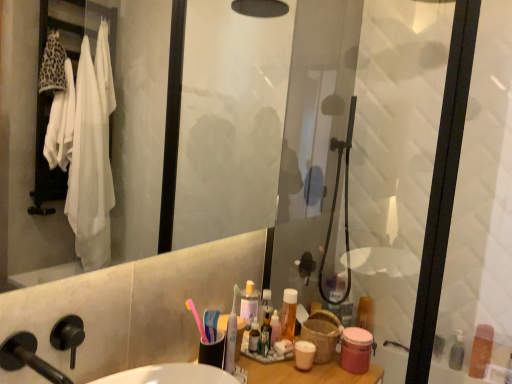
What is the approximate width of matte plastic container at right, which is the 1th toiletry from back to front?

matte plastic container at right, which is the 1th toiletry from back to front, is 4.00 inches wide.

What do you see at coordinates (28, 358) in the screenshot? I see `black matte faucet at lower left` at bounding box center [28, 358].

In order to face transparent glass shower door at right, should I rotate leftwards or rightwards?

You should look right and rotate roughly 17.187 degrees.

This screenshot has height=384, width=512. I want to click on matte plastic container at right, which is counted as the third toiletry, starting from the left, so click(365, 313).

What's the angular difference between black matte faucet at lower left and transparent glass shower door at right's facing directions?

88.7 degrees separate the facing orientations of black matte faucet at lower left and transparent glass shower door at right.

From the picture: From a real-world perspective, is black matte faucet at lower left under transparent glass shower door at right?

Indeed, from a real-world perspective, black matte faucet at lower left is positioned beneath transparent glass shower door at right.

Does black matte faucet at lower left have a greater width compared to transparent glass shower door at right?

Yes.

Would you say black matte faucet at lower left is a long distance from transparent glass shower door at right?

black matte faucet at lower left is far away from transparent glass shower door at right.

Is pink matte jar at lower right, placed as the first toiletry when sorted from front to back, turned away from matte plastic container at right, which is counted as the third toiletry, starting from the left?

No, pink matte jar at lower right, placed as the first toiletry when sorted from front to back, is not facing away from matte plastic container at right, which is counted as the third toiletry, starting from the left.

Is point (368, 363) closer to camera compared to point (368, 308)?

Yes, point (368, 363) is closer to viewer.

Considering the positions of objects pink matte jar at lower right, placed as the 3th toiletry when sorted from right to left, and matte plastic container at right, which is the 1th toiletry from back to front, in the image provided, who is more to the left, pink matte jar at lower right, placed as the 3th toiletry when sorted from right to left, or matte plastic container at right, which is the 1th toiletry from back to front,?

Positioned to the left is pink matte jar at lower right, placed as the 3th toiletry when sorted from right to left.

Locate an element on the screen. This screenshot has height=384, width=512. toothbrush in front of the pink matte jar at lower right, placed as the first toiletry when sorted from front to back is located at coordinates (231, 335).

Measure the distance between pink matte jar at lower right, the 2th toiletry when ordered from left to right, and white plastic toothbrush at center.

pink matte jar at lower right, the 2th toiletry when ordered from left to right, is 13.90 inches away from white plastic toothbrush at center.

Consider the image. What's the angular difference between pink matte jar at lower right, the 2th toiletry when ordered from left to right, and white plastic toothbrush at center's facing directions?

The facing directions of pink matte jar at lower right, the 2th toiletry when ordered from left to right, and white plastic toothbrush at center are 21.2 degrees apart.

Find the location of a particular element. toothbrush above the translucent orange bottle at upper right, which is the fourth toiletry from right to left (from the image's perspective) is located at coordinates (231, 335).

Is white plastic toothbrush at center positioned beyond the bounds of translucent orange bottle at upper right, which is the third toiletry from back to front?

white plastic toothbrush at center lies outside translucent orange bottle at upper right, which is the third toiletry from back to front,'s area.

Considering the sizes of objects white plastic toothbrush at center and translucent orange bottle at upper right, the 2th toiletry positioned from the front, in the image provided, who is taller, white plastic toothbrush at center or translucent orange bottle at upper right, the 2th toiletry positioned from the front,?

With more height is white plastic toothbrush at center.

Which is in front, transparent glass shower door at right or black matte faucet at lower left?

Positioned in front is black matte faucet at lower left.

From a real-world perspective, which object rests below the other?

In real-world perspective, black matte faucet at lower left is lower.

Which is closer to the camera, (463, 23) or (68, 383)?

Point (463, 23) is farther from the camera than point (68, 383).

Are transparent glass shower door at right and black matte faucet at lower left located far from each other?

transparent glass shower door at right is positioned a significant distance from black matte faucet at lower left.

Is pink matte jar at lower right, the 2th toiletry when ordered from left to right, oriented away from black matte faucet at lower left?

No, pink matte jar at lower right, the 2th toiletry when ordered from left to right,'s orientation is not away from black matte faucet at lower left.

Does point (346, 342) come in front of point (50, 376)?

No, (346, 342) is behind (50, 376).

Between pink matte jar at lower right, placed as the 3th toiletry when sorted from right to left, and black matte faucet at lower left, which one is positioned in front?

black matte faucet at lower left is in front.

At what (x,y) coordinates should I click in order to perform the action: click on faucet on the left of pink matte jar at lower right, the fourth toiletry when ordered from back to front. Please return your answer as a coordinate pair (x, y). Looking at the image, I should click on (28, 358).

From a real-world perspective, does white plastic toothbrush at center stand above translucent plastic bottle at lower right, placed as the first toiletry when sorted from right to left?

Indeed, from a real-world perspective, white plastic toothbrush at center stands above translucent plastic bottle at lower right, placed as the first toiletry when sorted from right to left.

How many degrees apart are the facing directions of white plastic toothbrush at center and translucent plastic bottle at lower right, the 4th toiletry when ordered from left to right?

They differ by 64.3 degrees in their facing directions.

From the picture: Considering the sizes of white plastic toothbrush at center and translucent plastic bottle at lower right, which is the second toiletry in back-to-front order, in the image, is white plastic toothbrush at center taller or shorter than translucent plastic bottle at lower right, which is the second toiletry in back-to-front order,?

white plastic toothbrush at center is taller than translucent plastic bottle at lower right, which is the second toiletry in back-to-front order.

Does white plastic toothbrush at center turn towards translucent plastic bottle at lower right, the third toiletry from the front?

No, white plastic toothbrush at center is not turned towards translucent plastic bottle at lower right, the third toiletry from the front.

This screenshot has height=384, width=512. I want to click on faucet that appears below the transparent glass shower door at right (from the image's perspective), so [28, 358].

Locate an element on the screen. the 3rd toiletry in front of the matte plastic container at right, the 4th toiletry positioned from the front is located at coordinates (356, 350).

Considering their positions, is translucent orange bottle at upper right, the 2th toiletry positioned from the front, positioned further to pink matte jar at lower right, the 2th toiletry when ordered from left to right, than translucent plastic bottle at lower right, placed as the first toiletry when sorted from right to left?

translucent plastic bottle at lower right, placed as the first toiletry when sorted from right to left, lies further to pink matte jar at lower right, the 2th toiletry when ordered from left to right, than the other object.

Looking at the image, which one is located further to translucent plastic bottle at lower right, the 4th toiletry when ordered from left to right, transparent glass shower door at right or white plastic toothbrush at center?

white plastic toothbrush at center lies further to translucent plastic bottle at lower right, the 4th toiletry when ordered from left to right, than the other object.

In the scene shown: Based on their spatial positions, is transparent glass shower door at right or black matte faucet at lower left closer to pink matte jar at lower right, placed as the first toiletry when sorted from front to back?

black matte faucet at lower left lies closer to pink matte jar at lower right, placed as the first toiletry when sorted from front to back, than the other object.

Estimate the real-world distances between objects in this image. Which object is closer to translucent plastic bottle at lower right, which is the second toiletry in back-to-front order, matte plastic container at right, which is counted as the third toiletry, starting from the left, or white plastic toothbrush at center?

The object closer to translucent plastic bottle at lower right, which is the second toiletry in back-to-front order, is matte plastic container at right, which is counted as the third toiletry, starting from the left.

Based on their spatial positions, is black matte faucet at lower left or transparent glass shower door at right further from white plastic toothbrush at center?

transparent glass shower door at right is further to white plastic toothbrush at center.

Estimate the real-world distances between objects in this image. Which object is further from white plastic toothbrush at center, matte plastic container at right, the 4th toiletry positioned from the front, or pink matte jar at lower right, the fourth toiletry when ordered from back to front?

matte plastic container at right, the 4th toiletry positioned from the front.

Which object lies nearer to the anchor point transparent glass shower door at right, pink matte jar at lower right, placed as the 3th toiletry when sorted from right to left, or matte plastic container at right, the 4th toiletry positioned from the front?

Among the two, matte plastic container at right, the 4th toiletry positioned from the front, is located nearer to transparent glass shower door at right.

Looking at the image, which one is located closer to translucent orange bottle at upper right, the 2th toiletry positioned from the front, transparent glass shower door at right or matte plastic container at right, which is counted as the third toiletry, starting from the left?

Based on the image, matte plastic container at right, which is counted as the third toiletry, starting from the left, appears to be nearer to translucent orange bottle at upper right, the 2th toiletry positioned from the front.

At what (x,y) coordinates should I click in order to perform the action: click on toothbrush positioned between black matte faucet at lower left and matte plastic container at right, the 4th toiletry positioned from the front, from near to far. Please return your answer as a coordinate pair (x, y). Image resolution: width=512 pixels, height=384 pixels. Looking at the image, I should click on (231, 335).

The height and width of the screenshot is (384, 512). Find the location of `toothbrush between black matte faucet at lower left and transparent glass shower door at right`. toothbrush between black matte faucet at lower left and transparent glass shower door at right is located at coordinates (231, 335).

At what (x,y) coordinates should I click in order to perform the action: click on toothbrush situated between black matte faucet at lower left and translucent plastic bottle at lower right, placed as the first toiletry when sorted from right to left, from left to right. Please return your answer as a coordinate pair (x, y). The height and width of the screenshot is (384, 512). Looking at the image, I should click on (231, 335).

Identify the location of screen door between white plastic toothbrush at center and translucent plastic bottle at lower right, the third toiletry from the front. Image resolution: width=512 pixels, height=384 pixels. (379, 160).